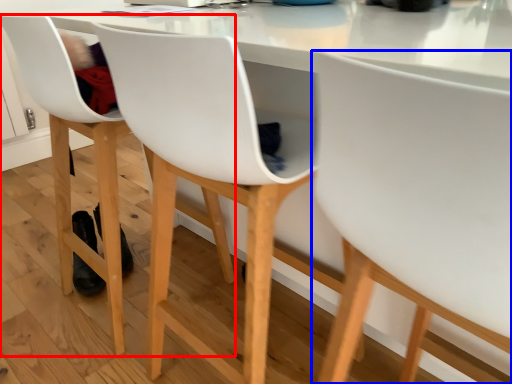
Question: Which object appears farthest to the camera in this image, chair (highlighted by a red box) or chair (highlighted by a blue box)?

Choices:
 (A) chair
 (B) chair

Answer: (A)